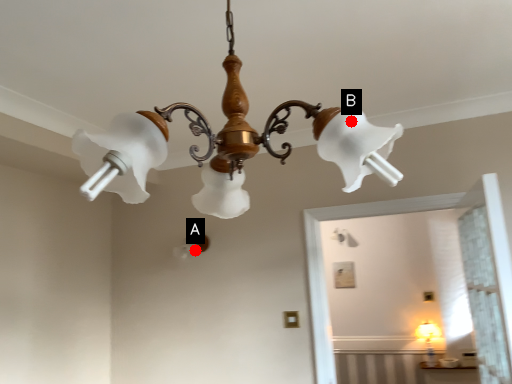
Question: Two points are circled on the image, labeled by A and B beside each circle. Which point appears farthest from the camera in this image?

Choices:
 (A) A is further
 (B) B is further

Answer: (A)